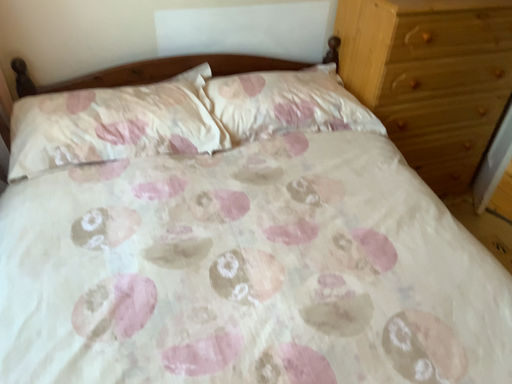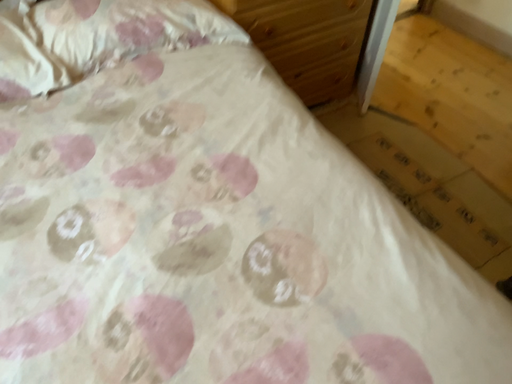
Question: Which way did the camera rotate in the video?

Choices:
 (A) rotated right
 (B) rotated left

Answer: (A)